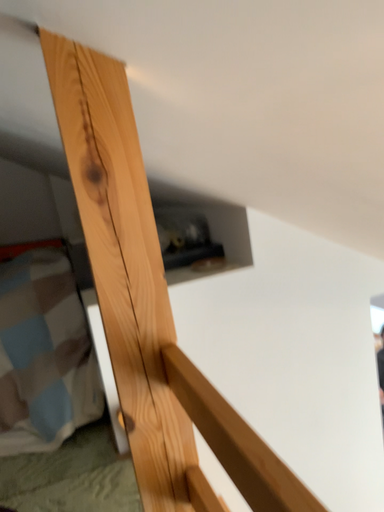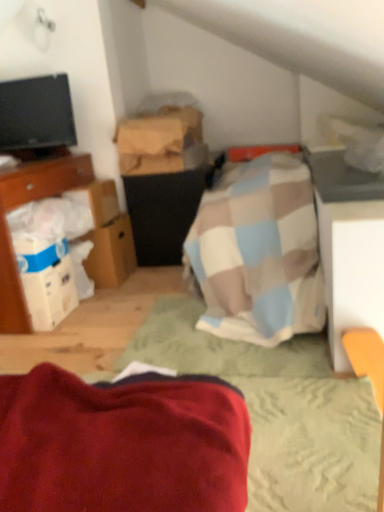
Question: Which way did the camera rotate in the video?

Choices:
 (A) rotated right
 (B) rotated left

Answer: (B)